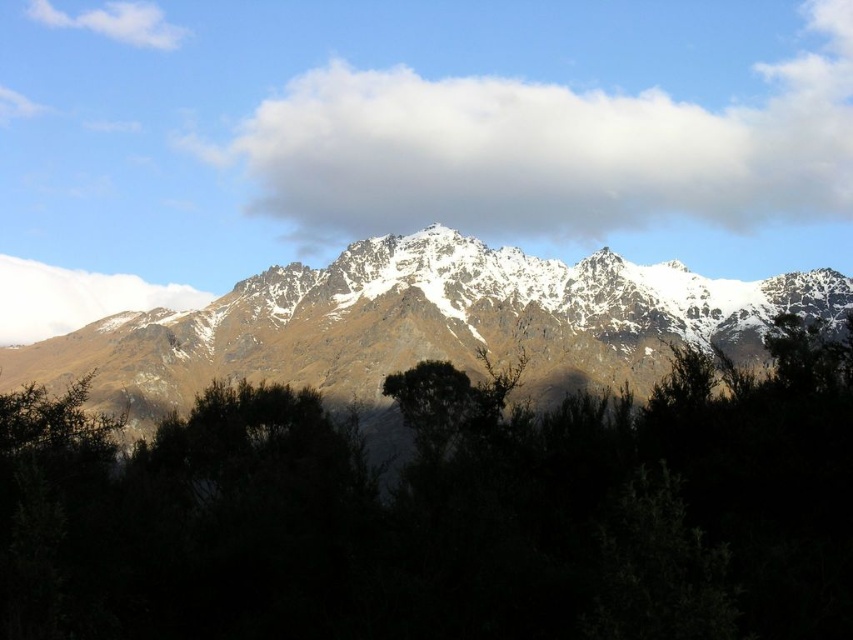
How far apart are white fluffy cloud at upper center and white fluffy cloud at left?

white fluffy cloud at upper center is 69.33 meters from white fluffy cloud at left.

Does white fluffy cloud at upper center lie behind white fluffy cloud at left?

Yes, it is.

I want to click on white fluffy cloud at upper center, so click(546, 150).

Who is positioned more to the right, brown textured tree at center or white fluffy cloud at upper left?

brown textured tree at center

Between point (161, 499) and point (157, 19), which one is positioned in front?

Point (161, 499) is more forward.

Is point (811, 388) behind point (32, 17)?

No, (811, 388) is in front of (32, 17).

Locate an element on the screen. This screenshot has height=640, width=853. brown textured tree at center is located at coordinates (445, 509).

Is snowy rocky mountain range at center wider than white fluffy cloud at upper left?

Correct, the width of snowy rocky mountain range at center exceeds that of white fluffy cloud at upper left.

Where is `snowy rocky mountain range at center`? snowy rocky mountain range at center is located at coordinates (422, 323).